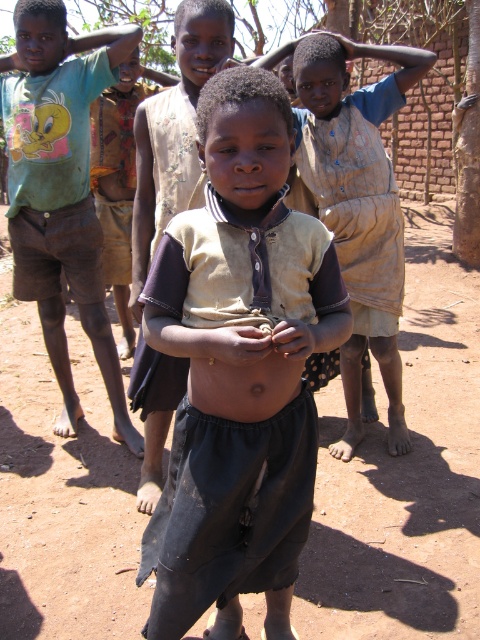
Question: Is dirt field at center thinner than skinny dark skin at center?

Choices:
 (A) yes
 (B) no

Answer: (B)

Question: Is dirt field at center further to the viewer compared to green t-shirt at left?

Choices:
 (A) yes
 (B) no

Answer: (B)

Question: Estimate the real-world distances between objects in this image. Which object is closer to the skinny dark skin at center?

Choices:
 (A) green t-shirt at left
 (B) dirty beige shirt at center

Answer: (B)

Question: Which of these objects is positioned closest to the dirty beige shirt at center?

Choices:
 (A) green t-shirt at left
 (B) dirt field at center

Answer: (B)

Question: Among these objects, which one is farthest from the camera?

Choices:
 (A) green t-shirt at left
 (B) dirt field at center
 (C) skinny dark skin at center

Answer: (A)

Question: Can you confirm if dirt field at center is bigger than dirty beige shirt at center?

Choices:
 (A) yes
 (B) no

Answer: (B)